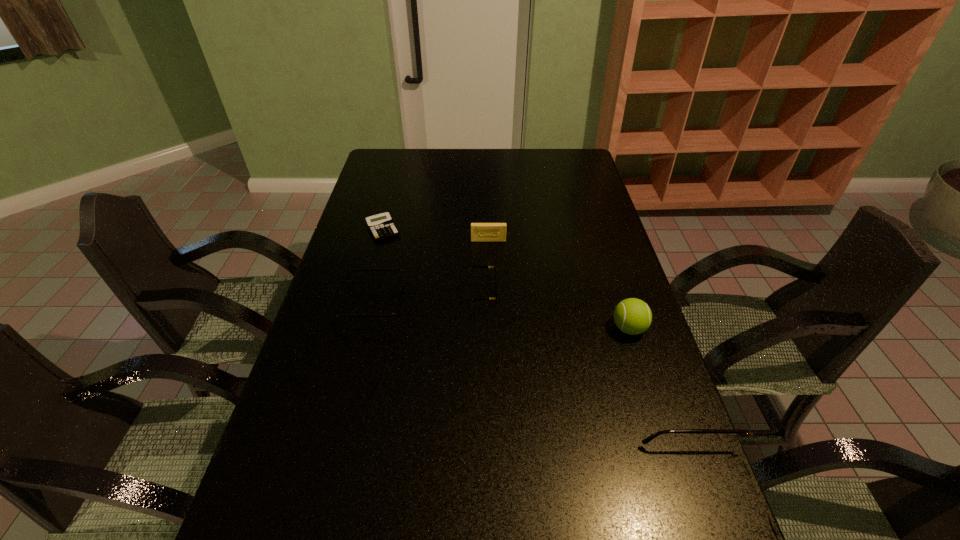
Locate an element on the screen. This screenshot has width=960, height=540. vacant spot for a new spectacles to ensure equal spacing is located at coordinates tap(511, 384).